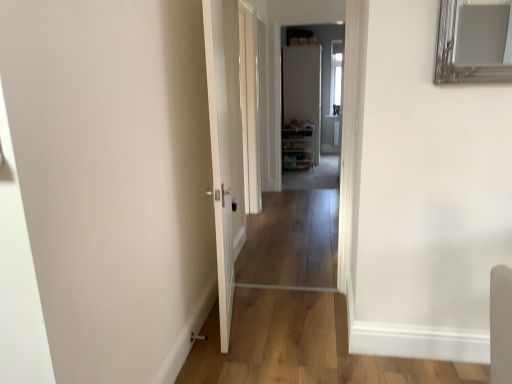
The image size is (512, 384). I want to click on clear glass door at center, so click(249, 107).

From the image's perspective, is white glossy door at center, the second door from the back, under clear glass door at center?

Indeed, from the image's perspective, white glossy door at center, the second door from the back, is shown beneath clear glass door at center.

Considering the sizes of white glossy door at center, the first door viewed from the front, and clear glass door at center in the image, is white glossy door at center, the first door viewed from the front, bigger or smaller than clear glass door at center?

white glossy door at center, the first door viewed from the front, is bigger than clear glass door at center.

In terms of width, does white glossy door at center, which appears as the second door when viewed from the right, look wider or thinner when compared to clear glass door at center?

white glossy door at center, which appears as the second door when viewed from the right, is wider than clear glass door at center.

How different are the orientations of white glossy door at center, the first door viewed from the front, and clear glass door at center in degrees?

The facing directions of white glossy door at center, the first door viewed from the front, and clear glass door at center are 11.5 degrees apart.

Consider the image. From a real-world perspective, which object rests below the other?

In real-world perspective, white glossy door at upper center, marked as the 2th door in a left-to-right arrangement, is lower.

Is white glossy door at upper center, the 1th door in the right-to-left sequence, wider than clear glass door at center?

Correct, the width of white glossy door at upper center, the 1th door in the right-to-left sequence, exceeds that of clear glass door at center.

Which point is more forward, (318, 145) or (244, 117)?

The point (244, 117) is closer to the camera.

Is white glossy door at upper center, which is the 2th door in front-to-back order, in contact with clear glass door at center?

No, white glossy door at upper center, which is the 2th door in front-to-back order, is not beside clear glass door at center.

Can you tell me how much white glossy door at center, the first door viewed from the front, and white glossy door at upper center, the 1th door when ordered from back to front, differ in facing direction?

white glossy door at center, the first door viewed from the front, and white glossy door at upper center, the 1th door when ordered from back to front, are facing 99.6 degrees away from each other.

Are white glossy door at center, the first door viewed from the front, and white glossy door at upper center, which is the 2th door in front-to-back order, making contact?

No, white glossy door at center, the first door viewed from the front, is not with white glossy door at upper center, which is the 2th door in front-to-back order.

Is white glossy door at center, which appears as the second door when viewed from the right, closer to camera compared to white glossy door at upper center, the 1th door in the right-to-left sequence?

That is True.

From a real-world perspective, which object stands above the other?

In real-world perspective, white glossy door at upper center, marked as the 2th door in a left-to-right arrangement, is above.

Considering the sizes of clear glass door at center and white glossy door at center, the second door from the back, in the image, is clear glass door at center bigger or smaller than white glossy door at center, the second door from the back,?

In the image, clear glass door at center appears to be smaller than white glossy door at center, the second door from the back.

Is clear glass door at center to the left of white glossy door at center, acting as the first door starting from the left, from the viewer's perspective?

Incorrect, clear glass door at center is not on the left side of white glossy door at center, acting as the first door starting from the left.

Considering the sizes of objects clear glass door at center and white glossy door at center, acting as the first door starting from the left, in the image provided, who is thinner, clear glass door at center or white glossy door at center, acting as the first door starting from the left,?

clear glass door at center is thinner.

Considering the sizes of clear glass door at center and white glossy door at center, the first door viewed from the front, in the image, is clear glass door at center taller or shorter than white glossy door at center, the first door viewed from the front,?

In the image, clear glass door at center appears to be taller than white glossy door at center, the first door viewed from the front.

From a real-world perspective, is clear glass door at center over white glossy door at upper center, the 1th door in the right-to-left sequence?

Yes.

How much distance is there between clear glass door at center and white glossy door at upper center, the 1th door when ordered from back to front?

clear glass door at center and white glossy door at upper center, the 1th door when ordered from back to front, are 13.27 feet apart.

In the image, is clear glass door at center on the left side or the right side of white glossy door at upper center, which is the 2th door in front-to-back order?

clear glass door at center is positioned on white glossy door at upper center, which is the 2th door in front-to-back order,'s left side.

Which point is more distant from viewer, (284,113) or (237,68)?

Point (284,113)

From the image's perspective, relative to white glossy door at center, the first door viewed from the front, is white glossy door at upper center, the 1th door in the right-to-left sequence, above or below?

Clearly, from the image's perspective, white glossy door at upper center, the 1th door in the right-to-left sequence, is above white glossy door at center, the first door viewed from the front.

Find the location of a particular element. The image size is (512, 384). door that is the 2nd one below the clear glass door at center (from a real-world perspective) is located at coordinates (225, 146).

Where is `glass door on the left of white glossy door at upper center, the 1th door in the right-to-left sequence`? This screenshot has height=384, width=512. glass door on the left of white glossy door at upper center, the 1th door in the right-to-left sequence is located at coordinates (249, 107).

Which object lies nearer to the anchor point clear glass door at center, white glossy door at upper center, the 1th door in the right-to-left sequence, or white glossy door at center, which appears as the second door when viewed from the right?

white glossy door at center, which appears as the second door when viewed from the right, lies closer to clear glass door at center than the other object.

Estimate the real-world distances between objects in this image. Which object is closer to white glossy door at center, acting as the first door starting from the left, clear glass door at center or white glossy door at upper center, the 1th door in the right-to-left sequence?

The object closer to white glossy door at center, acting as the first door starting from the left, is clear glass door at center.

Based on their spatial positions, is white glossy door at center, which appears as the second door when viewed from the right, or white glossy door at upper center, the 1th door when ordered from back to front, closer to clear glass door at center?

white glossy door at center, which appears as the second door when viewed from the right, is closer to clear glass door at center.

Based on their spatial positions, is white glossy door at center, the first door viewed from the front, or clear glass door at center further from white glossy door at upper center, the 1th door in the right-to-left sequence?

white glossy door at center, the first door viewed from the front, is positioned further to the anchor white glossy door at upper center, the 1th door in the right-to-left sequence.

Considering their positions, is clear glass door at center positioned closer to white glossy door at upper center, the 1th door in the right-to-left sequence, than white glossy door at center, acting as the first door starting from the left?

clear glass door at center.

Estimate the real-world distances between objects in this image. Which object is further from white glossy door at center, the second door from the back, white glossy door at upper center, the 1th door in the right-to-left sequence, or clear glass door at center?

white glossy door at upper center, the 1th door in the right-to-left sequence, lies further to white glossy door at center, the second door from the back, than the other object.

Find the location of a particular element. The width and height of the screenshot is (512, 384). glass door between white glossy door at center, the first door viewed from the front, and white glossy door at upper center, the 1th door when ordered from back to front, from front to back is located at coordinates (249, 107).